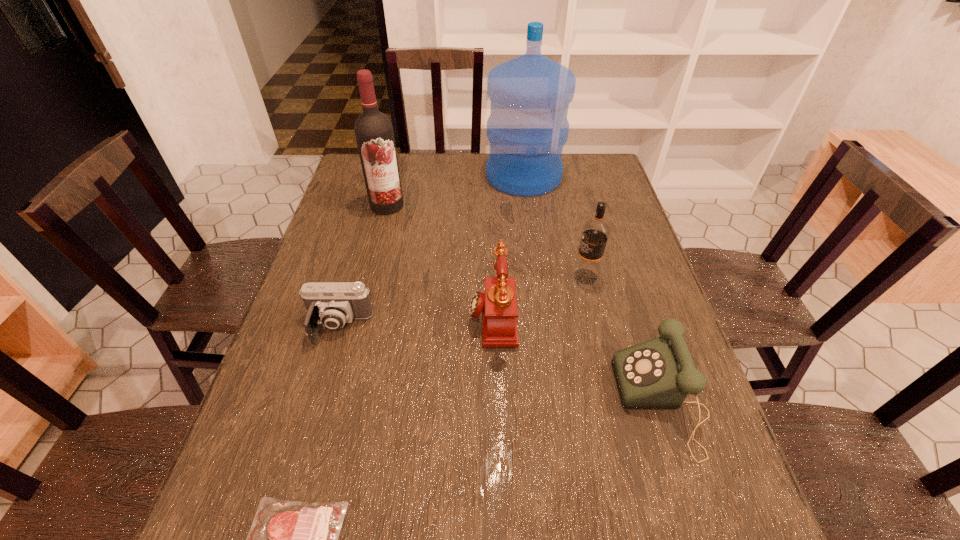
I want to click on vacant space located on the label of the vodka, so click(430, 276).

The height and width of the screenshot is (540, 960). Identify the location of vacant space located 0.200m on the label of the vodka. (497, 276).

Locate an element on the screen. This screenshot has width=960, height=540. blank space located 0.290m on the label of the vodka is located at coordinates (464, 276).

At what (x,y) coordinates should I click in order to perform the action: click on free space located on the dial of the left telephone. Please return your answer as a coordinate pair (x, y). Image resolution: width=960 pixels, height=540 pixels. Looking at the image, I should click on (372, 315).

Where is `blank area located on the dial of the left telephone`? Image resolution: width=960 pixels, height=540 pixels. blank area located on the dial of the left telephone is located at coordinates (396, 315).

Where is `vacant space located on the dial of the left telephone`? This screenshot has width=960, height=540. vacant space located on the dial of the left telephone is located at coordinates (340, 315).

At what (x,y) coordinates should I click in order to perform the action: click on vacant region located 0.220m on the dial of the shorter telephone. Please return your answer as a coordinate pair (x, y). The height and width of the screenshot is (540, 960). Looking at the image, I should click on (515, 402).

The height and width of the screenshot is (540, 960). I want to click on vacant space located on the dial of the shorter telephone, so click(x=477, y=402).

Locate an element on the screen. blank space located 0.380m on the dial of the shorter telephone is located at coordinates (439, 402).

Identify the location of free space located 0.380m at the front of the camera with an open lens cover. The height and width of the screenshot is (540, 960). (280, 529).